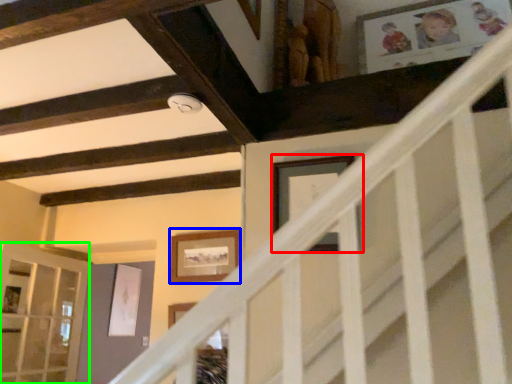
Question: Which is farther away from picture frame (highlighted by a red box)? picture frame (highlighted by a blue box) or glass door (highlighted by a green box)?

Choices:
 (A) picture frame
 (B) glass door

Answer: (B)